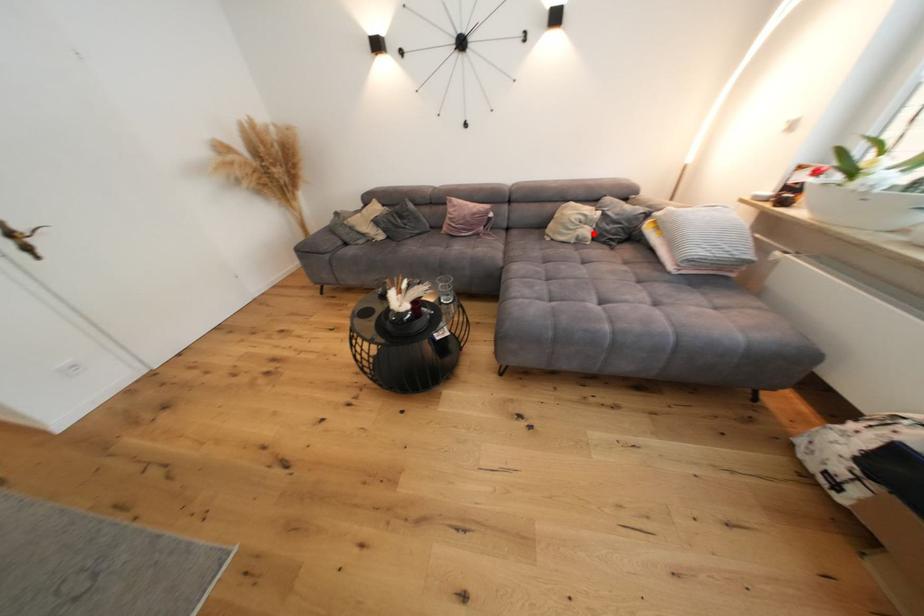
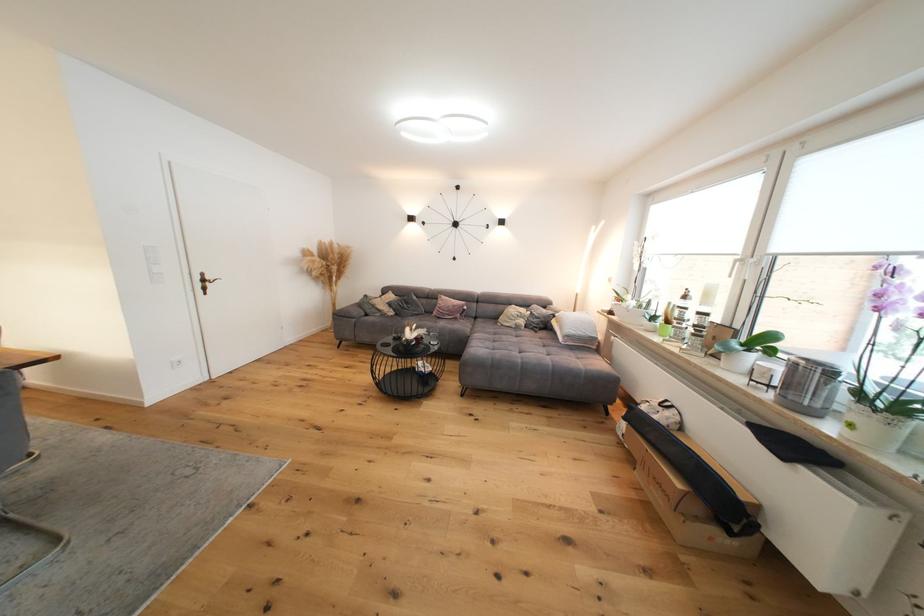
Locate, in the second image, the point that corresponds to the highlighted location in the first image.

(529, 323)